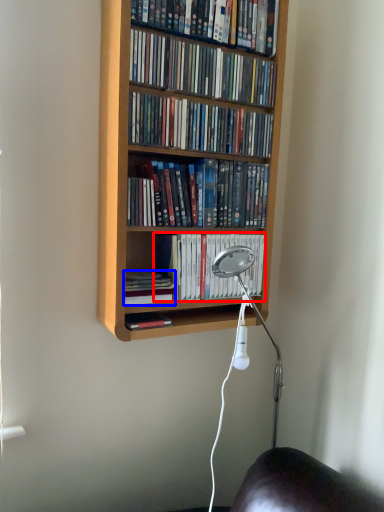
Question: Which point is closer to the camera, book (highlighted by a red box) or book (highlighted by a blue box)?

Choices:
 (A) book
 (B) book

Answer: (B)